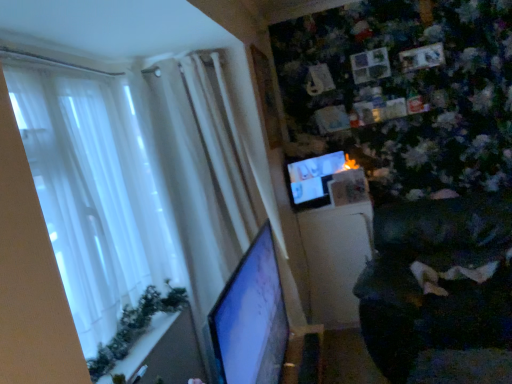
Question: From a real-world perspective, is matte black monitor at center, the second computer monitor in the front-to-back sequence, physically located above or below matte black monitor at left, the second computer monitor in the top-to-bottom sequence?

Choices:
 (A) below
 (B) above

Answer: (B)

Question: Considering the positions of matte black monitor at center, marked as the second computer monitor in a left-to-right arrangement, and matte black monitor at left, the 2th computer monitor when ordered from right to left, in the image, is matte black monitor at center, marked as the second computer monitor in a left-to-right arrangement, wider or thinner than matte black monitor at left, the 2th computer monitor when ordered from right to left,?

Choices:
 (A) wide
 (B) thin

Answer: (B)

Question: Estimate the real-world distances between objects in this image. Which object is closer to the matte black monitor at center, the second computer monitor in the front-to-back sequence?

Choices:
 (A) dark fabric swivel chair at lower right
 (B) matte black monitor at left, placed as the 2th computer monitor when sorted from back to front
 (C) white sheer curtain at left

Answer: (C)

Question: Based on their relative distances, which object is farther from the dark fabric swivel chair at lower right?

Choices:
 (A) white sheer curtain at left
 (B) matte black monitor at left, the second computer monitor in the top-to-bottom sequence
 (C) matte black monitor at center, positioned as the 1th computer monitor in top-to-bottom order

Answer: (A)